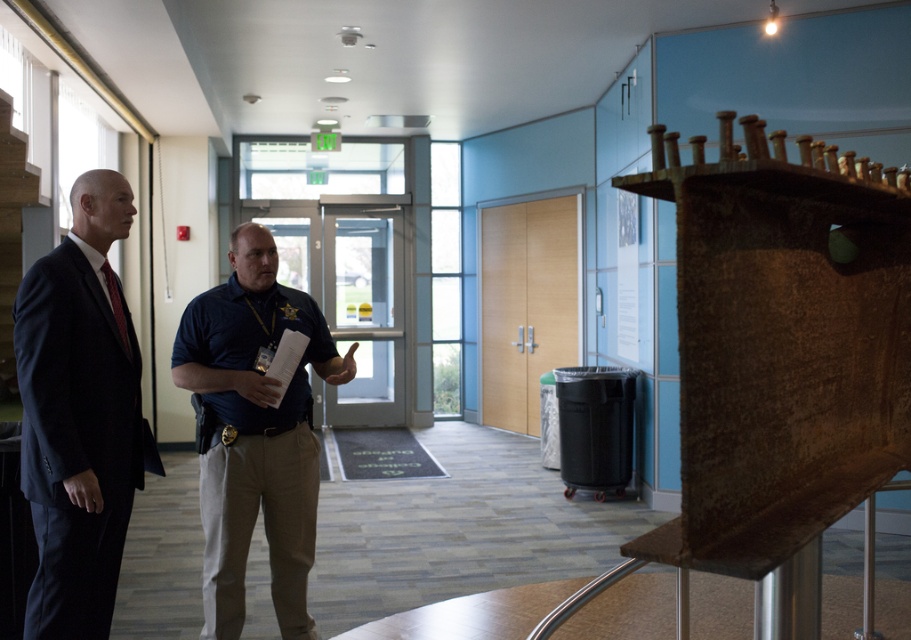
You are a security guard standing in the hallway. You need to check the height of the dark blue suit at left and the dark blue uniform at center to ensure they meet the building safety standards. Which person is shorter?

The dark blue suit at left is shorter than the dark blue uniform at center, so the person in the dark blue suit at left is shorter.

You are a delivery person carrying a large box that is 18 inches wide. You need to walk through the hallway between the dark blue suit at left and the dark blue uniform at center. Will you be able to pass through without touching either of them?

The dark blue suit at left and dark blue uniform at center are 17.22 inches apart, which is narrower than the 18 inches width of your box. Therefore, you will not be able to pass through without touching them.